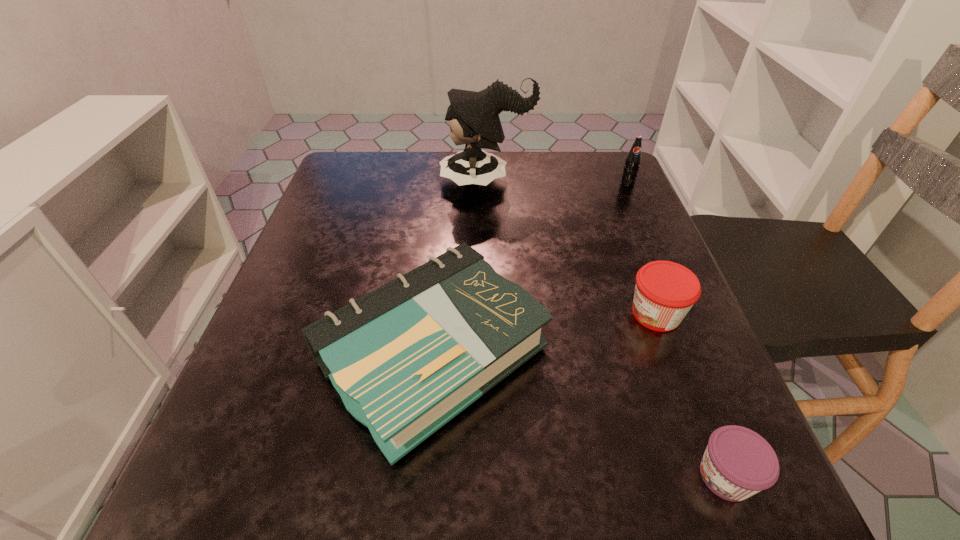
In the image, there is a desktop. Where is `free region at the far right corner`? free region at the far right corner is located at coordinates (576, 162).

The image size is (960, 540). Identify the location of vacant space at the near right corner. (729, 527).

The width and height of the screenshot is (960, 540). Identify the location of blank region between the shortest object and the taller jam. (690, 395).

This screenshot has height=540, width=960. I want to click on free area in between the paperback book and the second tallest object, so click(x=530, y=268).

Find the location of a particular element. This screenshot has width=960, height=540. vacant area between the tallest object and the second tallest object is located at coordinates tap(557, 183).

Where is `vacant area between the pop and the shorter jam`? vacant area between the pop and the shorter jam is located at coordinates (677, 330).

Locate an element on the screen. The image size is (960, 540). empty location between the doll and the pop is located at coordinates pos(557,183).

At what (x,y) coordinates should I click in order to perform the action: click on empty location between the shortest object and the fourth shortest object. Please return your answer as a coordinate pair (x, y). The image size is (960, 540). Looking at the image, I should click on (677, 330).

I want to click on empty space that is in between the taller jam and the paperback book, so click(544, 334).

At what (x,y) coordinates should I click in order to perform the action: click on free point between the nearer jam and the pop. Please return your answer as a coordinate pair (x, y). Looking at the image, I should click on (677, 330).